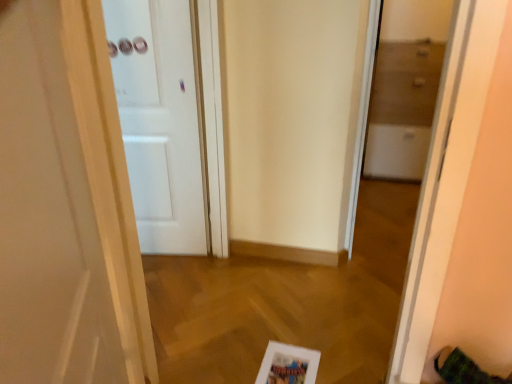
Question: Considering the relative positions of white glossy door at left, acting as the first door starting from the front, and transparent glass cabinet at right in the image provided, is white glossy door at left, acting as the first door starting from the front, to the left or to the right of transparent glass cabinet at right?

Choices:
 (A) right
 (B) left

Answer: (B)

Question: Based on their sizes in the image, would you say white glossy door at left, the second door viewed from the back, is bigger or smaller than transparent glass cabinet at right?

Choices:
 (A) small
 (B) big

Answer: (B)

Question: Which object is positioned farthest from the white matte picture frame at lower center?

Choices:
 (A) transparent glass cabinet at right
 (B) white matte door at center, which appears as the 1th door when viewed from the back
 (C) white glossy door at left, acting as the first door starting from the front

Answer: (B)

Question: Which object is the closest to the white glossy door at left, the second door viewed from the back?

Choices:
 (A) white matte picture frame at lower center
 (B) transparent glass cabinet at right
 (C) white matte door at center, which appears as the 1th door when viewed from the back

Answer: (A)